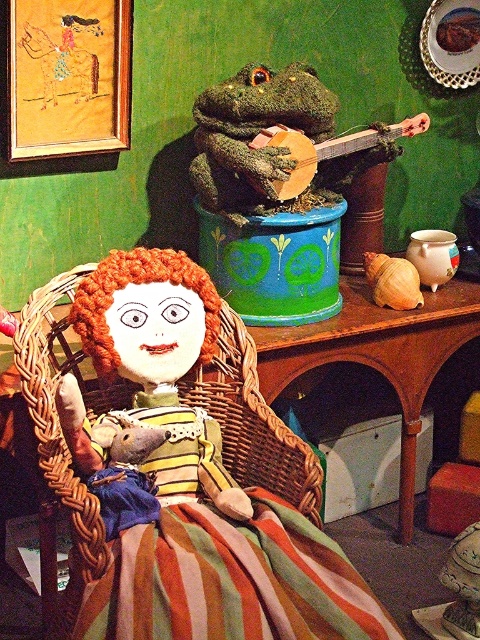
You are a musician who wants to play the wooden banjo at upper center but it is currently 22.66 inches away from the embroidered silk horse at upper left. Can you reach the banjo without moving the horse?

The wooden banjo at upper center and embroidered silk horse at upper left are 22.66 inches apart. Since the distance between them is over 2 feet, you can likely reach the banjo without disturbing the embroidered silk horse at upper left.

You are standing in front of the vibrant green wall and want to place a 1.5 meter long decorative banner in the scene. The banner requires 1.5 meters of space to hang properly. Can you determine if there is enough space between you and the woven wicker basket at center to hang the banner?

The woven wicker basket at center is 1.44 meters away from viewer. Since the banner requires 1.5 meters of space and the distance is only 1.44 meters, there isn

You are standing in front of the image and want to know how far the point at coordinates [64,305] is from your current position. Can you determine the distance?

The point at coordinates [64,305] is 7.40 feet away from the camera, so it is 7.40 feet away from your current position.